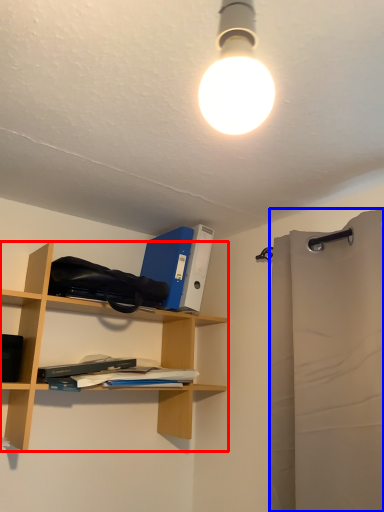
Question: Among these objects, which one is nearest to the camera, shelf (highlighted by a red box) or shower curtain (highlighted by a blue box)?

Choices:
 (A) shelf
 (B) shower curtain

Answer: (B)